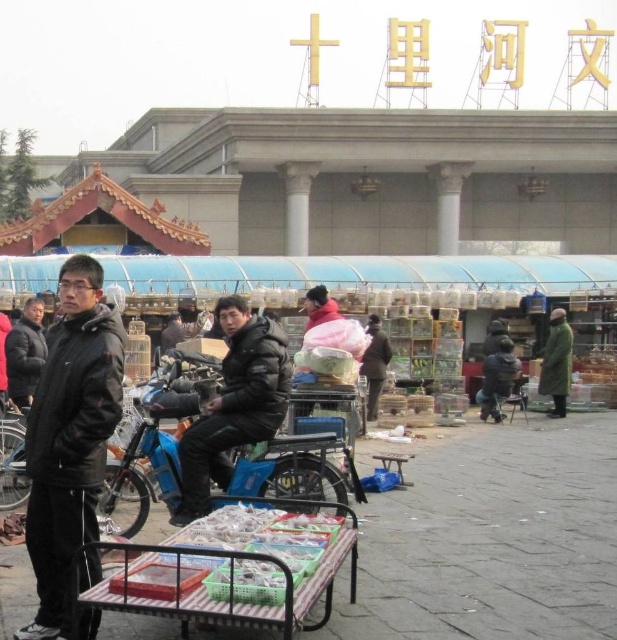
You are a delivery person who needs to place a package on the translucent plastic tray at lower center. You are currently standing next to the metallic silver cart at lower center. Can you reach the tray without moving either object?

The distance between the metallic silver cart at lower center and the translucent plastic tray at lower center is 3.44 feet. Since the tray is only 3.44 feet away, you can likely reach it without moving either object, assuming your arm length is sufficient.

You are at the outdoor market and want to buy a jacket. Where is the black leather jacket at left located in the scene?

The black leather jacket at left is located at point (70, 445) in the scene.